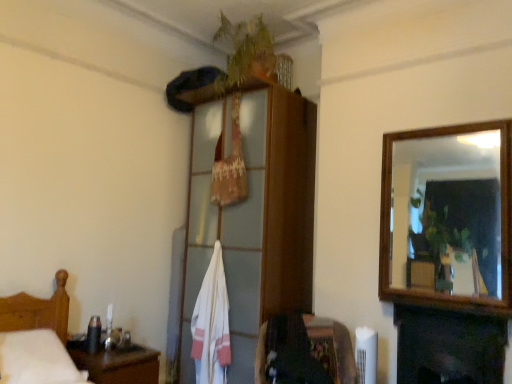
Measure the distance between point (267, 354) and camera.

They are 8.47 feet apart.

I want to click on wooden table at lower left, so click(x=118, y=365).

Where is `dark wood fireplace at lower right`? dark wood fireplace at lower right is located at coordinates (448, 346).

The width and height of the screenshot is (512, 384). Identify the location of green leafy plant at upper center. pyautogui.click(x=246, y=51).

Image resolution: width=512 pixels, height=384 pixels. Identify the location of velvet dark brown chair at lower center. (289, 353).

From a real-world perspective, is green leafy plant at upper center over velvet dark brown chair at lower center?

Indeed, from a real-world perspective, green leafy plant at upper center stands above velvet dark brown chair at lower center.

Which is closer to the camera, (258, 71) or (270, 332)?

Clearly, point (258, 71) is more distant from the camera than point (270, 332).

Is green leafy plant at upper center to the right of velvet dark brown chair at lower center from the viewer's perspective?

No.

Is wooden table at lower left positioned far away from wooden cabinet at upper center?

That's right, there is a large distance between wooden table at lower left and wooden cabinet at upper center.

Does wooden table at lower left come in front of wooden cabinet at upper center?

Yes, wooden table at lower left is in front of wooden cabinet at upper center.

Between wooden table at lower left and wooden cabinet at upper center, which one appears on the right side from the viewer's perspective?

wooden cabinet at upper center.

How far apart are dark wood fireplace at lower right and green leafy plant at upper center?

dark wood fireplace at lower right is 1.98 meters from green leafy plant at upper center.

Does dark wood fireplace at lower right have a larger size compared to green leafy plant at upper center?

Actually, dark wood fireplace at lower right might be smaller than green leafy plant at upper center.

Which is further, (x=429, y=348) or (x=227, y=60)?

The point (x=227, y=60) is farther from the camera.

In the scene shown: Is the depth of dark wood fireplace at lower right less than that of green leafy plant at upper center?

Yes.

From the image's perspective, would you say wooden headboard at left is positioned over white cotton bath towel at center?

No, from the image's perspective, wooden headboard at left is not above white cotton bath towel at center.

Based on the photo, is the position of wooden headboard at left more distant than that of white cotton bath towel at center?

No, it is not.

Do you think wooden headboard at left is within white cotton bath towel at center, or outside of it?

wooden headboard at left cannot be found inside white cotton bath towel at center.

Who is taller, wooden table at lower left or velvet dark brown chair at lower center?

With more height is velvet dark brown chair at lower center.

Which is in front, wooden table at lower left or velvet dark brown chair at lower center?

Positioned in front is velvet dark brown chair at lower center.

In the scene shown: From a real-world perspective, which object rests below the other?

wooden table at lower left, from a real-world perspective.

Are wooden table at lower left and velvet dark brown chair at lower center beside each other?

There is a gap between wooden table at lower left and velvet dark brown chair at lower center.

Is point (268, 313) in front of point (504, 327)?

That is False.

Between wooden cabinet at upper center and dark wood fireplace at lower right, which one appears on the right side from the viewer's perspective?

From the viewer's perspective, dark wood fireplace at lower right appears more on the right side.

From a real-world perspective, which object stands above the other?

wooden cabinet at upper center is physically above.

Which is more to the left, wooden table at lower left or white cotton bath towel at center?

wooden table at lower left is more to the left.

From a real-world perspective, is wooden table at lower left positioned over white cotton bath towel at center based on gravity?

Incorrect, from a real-world perspective, wooden table at lower left is lower than white cotton bath towel at center.

Considering the sizes of wooden table at lower left and white cotton bath towel at center in the image, is wooden table at lower left wider or thinner than white cotton bath towel at center?

wooden table at lower left is wider than white cotton bath towel at center.

Would you consider wooden table at lower left to be distant from white cotton bath towel at center?

No, wooden table at lower left is not far from white cotton bath towel at center.

I want to click on chair below the green leafy plant at upper center (from a real-world perspective), so click(x=289, y=353).

Identify the location of dresser that appears behind the wooden table at lower left. (251, 214).

Which object lies nearer to the anchor point wooden headboard at left, dark wood fireplace at lower right or wooden cabinet at upper center?

wooden cabinet at upper center lies closer to wooden headboard at left than the other object.

In the scene shown: When comparing their distances from dark wood fireplace at lower right, does wooden table at lower left or green leafy plant at upper center seem closer?

Among the two, wooden table at lower left is located nearer to dark wood fireplace at lower right.

Based on their spatial positions, is wooden cabinet at upper center or green leafy plant at upper center closer to wooden headboard at left?

wooden cabinet at upper center is closer to wooden headboard at left.

From the image, which object appears to be nearer to velvet dark brown chair at lower center, dark wood fireplace at lower right or wooden cabinet at upper center?

The object closer to velvet dark brown chair at lower center is wooden cabinet at upper center.

Looking at the image, which one is located closer to wooden cabinet at upper center, green leafy plant at upper center or wooden table at lower left?

green leafy plant at upper center is positioned closer to the anchor wooden cabinet at upper center.

Which object lies nearer to the anchor point wooden cabinet at upper center, dark wood fireplace at lower right or wooden headboard at left?

dark wood fireplace at lower right.

Based on their spatial positions, is green leafy plant at upper center or wooden headboard at left further from wooden cabinet at upper center?

Among the two, wooden headboard at left is located further to wooden cabinet at upper center.

Based on their spatial positions, is wooden cabinet at upper center or velvet dark brown chair at lower center further from wooden headboard at left?

wooden cabinet at upper center lies further to wooden headboard at left than the other object.

Identify the location of dresser between green leafy plant at upper center and wooden table at lower left from top to bottom. The image size is (512, 384). (251, 214).

You are a GUI agent. You are given a task and a screenshot of the screen. Output one action in this format:
    pyautogui.click(x=<x>, y=<y>)
    Task: Click on the bath towel situated between wooden headboard at left and wooden cabinet at upper center from left to right
    
    Given the screenshot: What is the action you would take?
    pyautogui.click(x=212, y=324)

Identify the location of chair situated between wooden table at lower left and dark wood fireplace at lower right from left to right. The height and width of the screenshot is (384, 512). (289, 353).

The image size is (512, 384). What are the coordinates of `dresser between wooden table at lower left and velvet dark brown chair at lower center from left to right` in the screenshot? It's located at (251, 214).